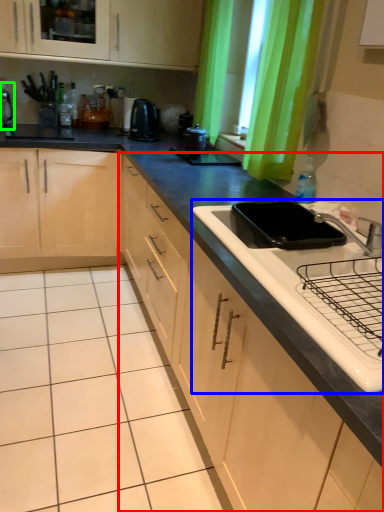
Question: Which is farther away from cabinetry (highlighted by a red box)? sink (highlighted by a blue box) or appliance (highlighted by a green box)?

Choices:
 (A) sink
 (B) appliance

Answer: (B)